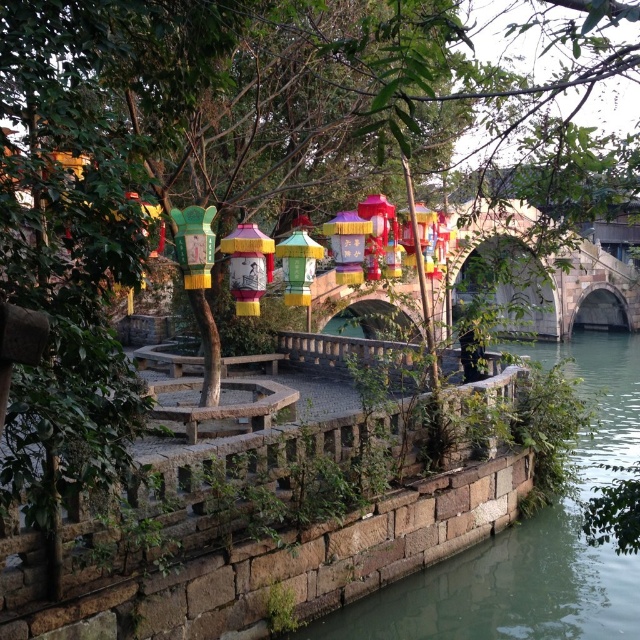
Question: Does stone arch bridge at center have a greater width compared to yellow-green paper lantern at center?

Choices:
 (A) yes
 (B) no

Answer: (A)

Question: Among these points, which one is nearest to the camera?

Choices:
 (A) (241, 257)
 (B) (572, 339)
 (C) (616, 300)
 (D) (307, 246)

Answer: (A)

Question: Which point is closer to the camera taking this photo?

Choices:
 (A) (200, 236)
 (B) (300, 227)

Answer: (A)

Question: Does yellow paper lantern at center appear over yellow-green paper lantern at center?

Choices:
 (A) no
 (B) yes

Answer: (A)

Question: Which of the following is the farthest from the observer?

Choices:
 (A) (300, 264)
 (B) (556, 557)

Answer: (B)

Question: Is stone arch bridge at center smaller than yellow-green paper lantern at center?

Choices:
 (A) yes
 (B) no

Answer: (B)